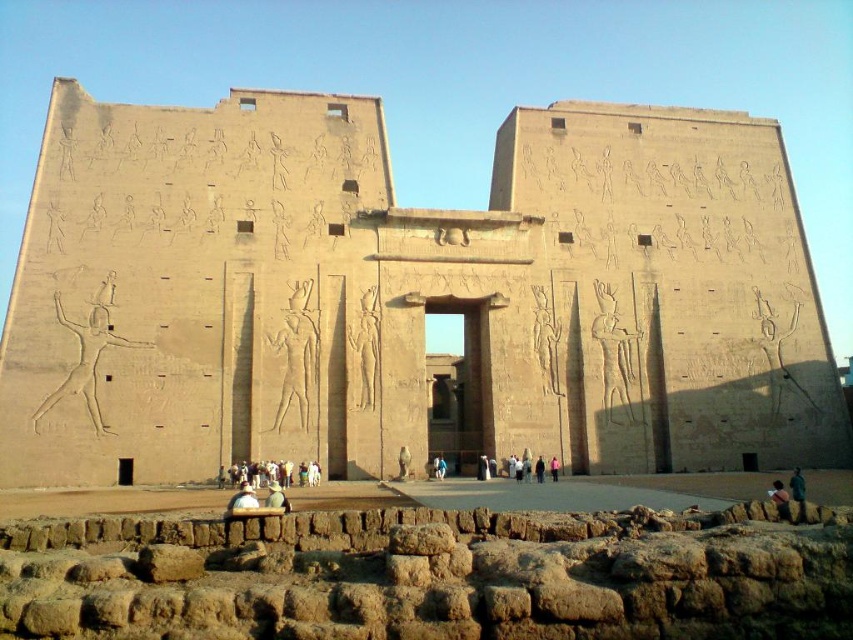
You are an archaeologist standing in front of the Temple of Horus at Edfu. You notice both the sandstone temple at center and the white cotton clothing at center. Which object is wider?

The sandstone temple at center is wider than the white cotton clothing at center according to the description.